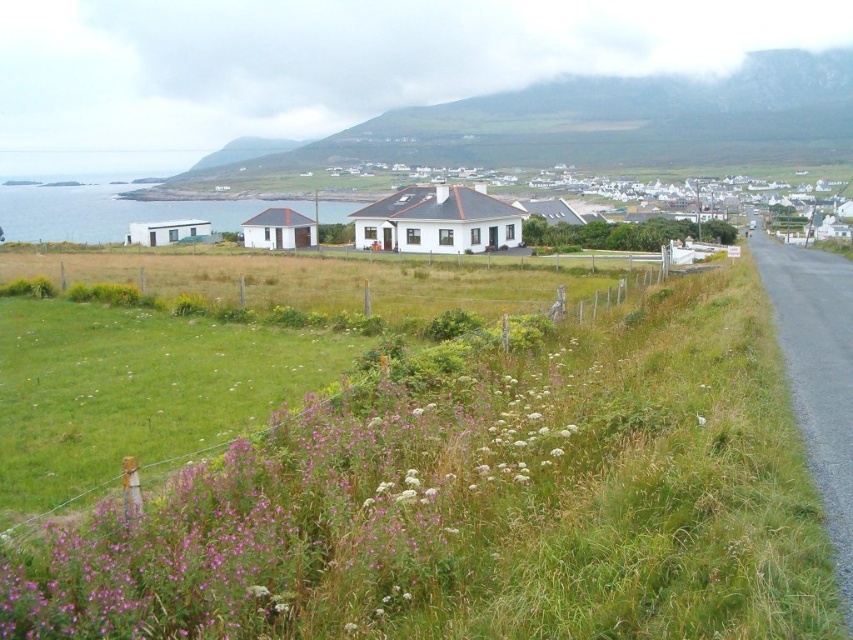
You are standing at the camera position and want to walk to both points. Which point should you reach first, point (316, 605) or point (373, 176)?

You will reach point (316, 605) first because it is closer to the camera than point (373, 176).

You are a drone operator tasked with capturing aerial footage of the purple soft grass at lower left and the white matte house at center. The drone has a maximum flight range of 500 feet. Can you reach both locations from your current position without exceeding the drone range?

The distance between the purple soft grass at lower left and the white matte house at center is 677.79 feet, which exceeds the drone range of 500 feet. Therefore, you cannot capture both locations without exceeding the drone range.

You are standing in the middle of the grassy field with wildflowers and want to walk towards both the point at coordinates point (531,99) and point (294,186). Which point will you reach first?

You will reach point (531,99) first because it is closer to you than point (294,186), which is further away.